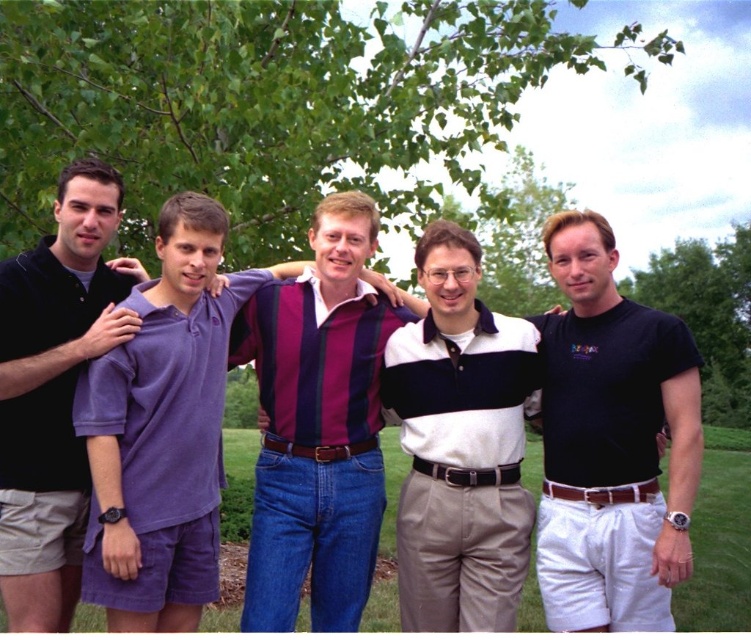
Based on the scene description, which object is positioned lower between the purple cotton polo shirt at center and the velvet black polo shirt at left?

The purple cotton polo shirt at center is located below the velvet black polo shirt at left.